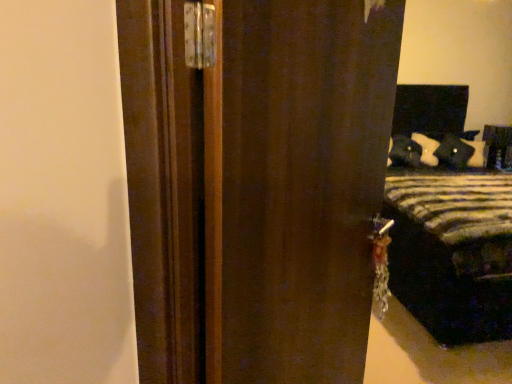
Question: From the image's perspective, is velvet black pillow at right positioned above or below striped fabric bed at right?

Choices:
 (A) above
 (B) below

Answer: (A)

Question: Considering the positions of velvet black pillow at right and striped fabric bed at right in the image, is velvet black pillow at right bigger or smaller than striped fabric bed at right?

Choices:
 (A) small
 (B) big

Answer: (A)

Question: Estimate the real-world distances between objects in this image. Which object is farther from the velvet black pillow at right?

Choices:
 (A) matte black pillow at upper right
 (B) dark wood door at center
 (C) striped fabric bed at right

Answer: (B)

Question: Considering the real-world distances, which object is closest to the dark wood door at center?

Choices:
 (A) striped fabric bed at right
 (B) matte black pillow at upper right
 (C) velvet black pillow at right

Answer: (A)